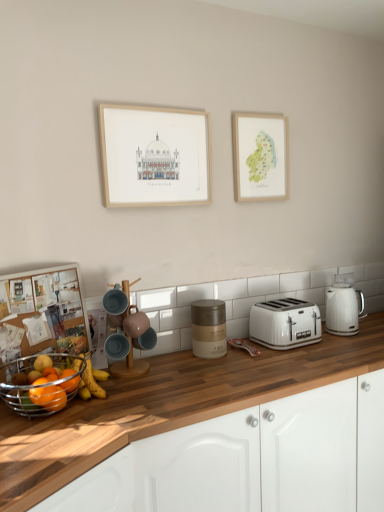
Identify the location of vacant point to the right of white plastic toaster at center. (340, 345).